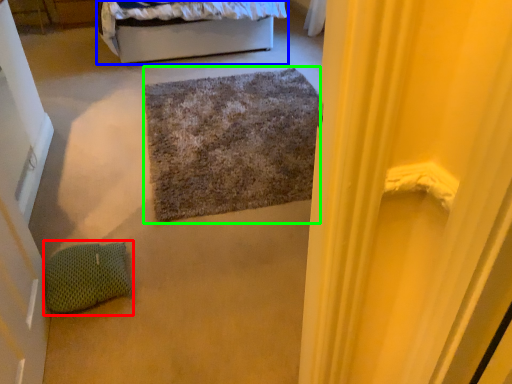
Question: Which is farther away from pillow (highlighted by a red box)? bed (highlighted by a blue box) or doormat (highlighted by a green box)?

Choices:
 (A) bed
 (B) doormat

Answer: (A)